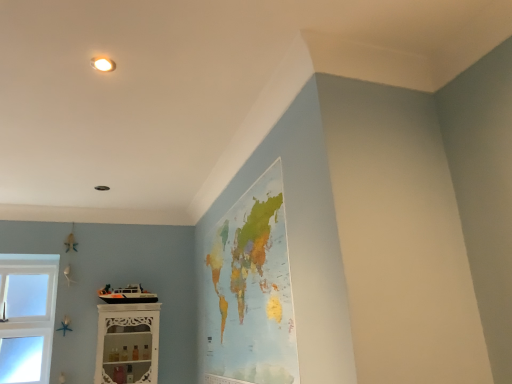
Question: Does watercolor paper map at upper center touch white carved wood shelf at lower left?

Choices:
 (A) yes
 (B) no

Answer: (B)

Question: Is watercolor paper map at upper center oriented towards white carved wood shelf at lower left?

Choices:
 (A) yes
 (B) no

Answer: (A)

Question: From a real-world perspective, is watercolor paper map at upper center physically below white carved wood shelf at lower left?

Choices:
 (A) yes
 (B) no

Answer: (B)

Question: Is white carved wood shelf at lower left at the back of watercolor paper map at upper center?

Choices:
 (A) no
 (B) yes

Answer: (A)

Question: Is watercolor paper map at upper center shorter than white carved wood shelf at lower left?

Choices:
 (A) no
 (B) yes

Answer: (A)

Question: Is watercolor paper map at upper center positioned in front of white carved wood shelf at lower left?

Choices:
 (A) no
 (B) yes

Answer: (B)

Question: From a real-world perspective, is white carved wood shelf at lower left located beneath watercolor paper map at upper center?

Choices:
 (A) yes
 (B) no

Answer: (A)

Question: Is white carved wood shelf at lower left facing towards watercolor paper map at upper center?

Choices:
 (A) no
 (B) yes

Answer: (B)

Question: Considering the relative sizes of white carved wood shelf at lower left and watercolor paper map at upper center in the image provided, is white carved wood shelf at lower left bigger than watercolor paper map at upper center?

Choices:
 (A) no
 (B) yes

Answer: (A)

Question: Considering the relative sizes of white carved wood shelf at lower left and watercolor paper map at upper center in the image provided, is white carved wood shelf at lower left thinner than watercolor paper map at upper center?

Choices:
 (A) yes
 (B) no

Answer: (B)

Question: Is white carved wood shelf at lower left wider than watercolor paper map at upper center?

Choices:
 (A) yes
 (B) no

Answer: (A)

Question: Is watercolor paper map at upper center a part of white carved wood shelf at lower left?

Choices:
 (A) no
 (B) yes

Answer: (A)

Question: Is white carved wood shelf at lower left inside or outside of watercolor paper map at upper center?

Choices:
 (A) inside
 (B) outside

Answer: (B)